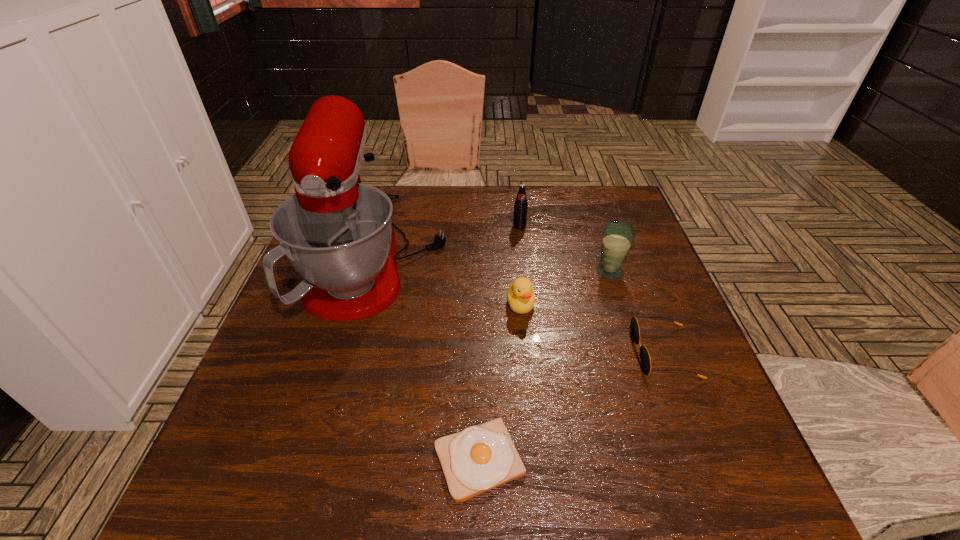
Find the location of a particular element. The width and height of the screenshot is (960, 540). mixer is located at coordinates (337, 233).

Locate an element on the screen. The image size is (960, 540). the leftmost object is located at coordinates (x=337, y=233).

I want to click on pop, so click(x=520, y=211).

Locate an element on the screen. Image resolution: width=960 pixels, height=540 pixels. glass is located at coordinates (618, 236).

Find the location of a particular element. the third shortest object is located at coordinates (521, 299).

Find the location of a particular element. The height and width of the screenshot is (540, 960). sunglasses is located at coordinates (645, 359).

The height and width of the screenshot is (540, 960). What are the coordinates of `the shortest object` in the screenshot? It's located at (482, 457).

Where is `toast`? toast is located at coordinates (482, 457).

Image resolution: width=960 pixels, height=540 pixels. I want to click on vacant space located 0.400m on the bowl side of the tallest object, so click(596, 253).

Locate an element on the screen. The height and width of the screenshot is (540, 960). vacant space situated on the front label of the pop is located at coordinates (523, 261).